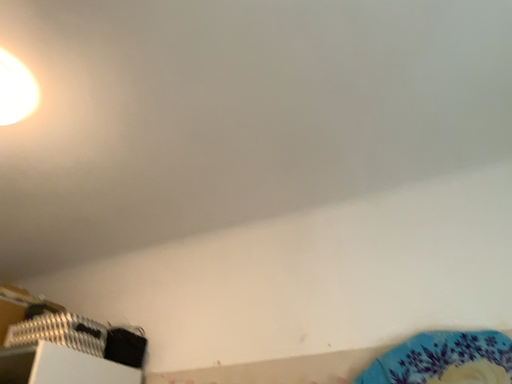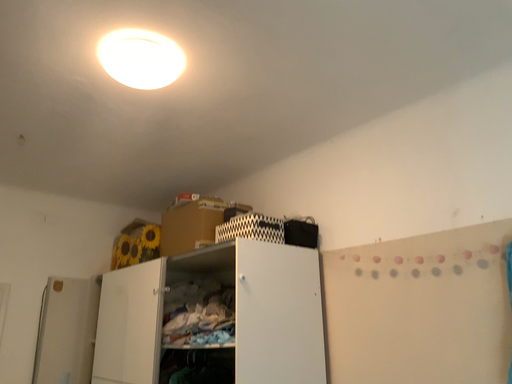
Question: Which way did the camera rotate in the video?

Choices:
 (A) rotated upward
 (B) rotated downward

Answer: (B)